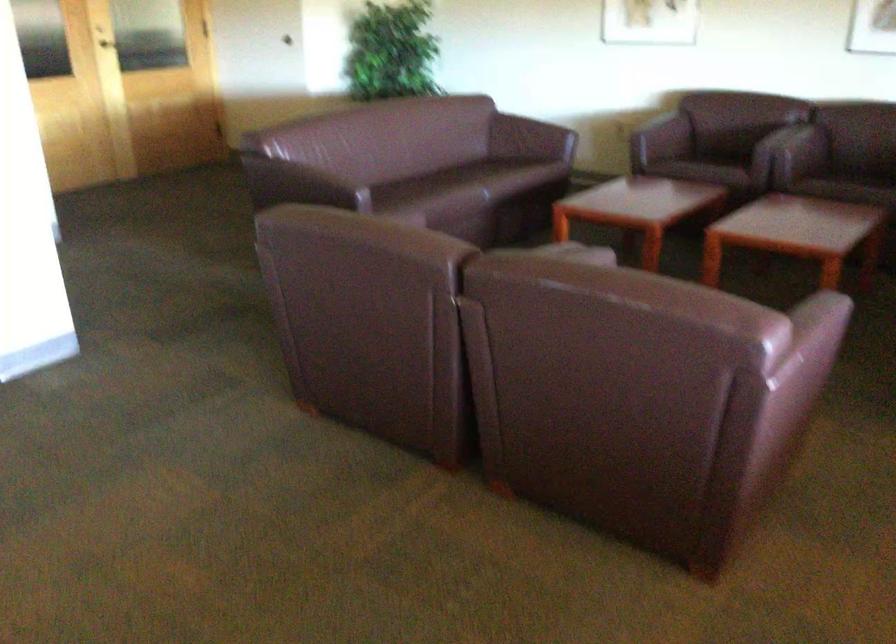
Locate an element on the screen. Image resolution: width=896 pixels, height=644 pixels. door handle is located at coordinates (114, 46).